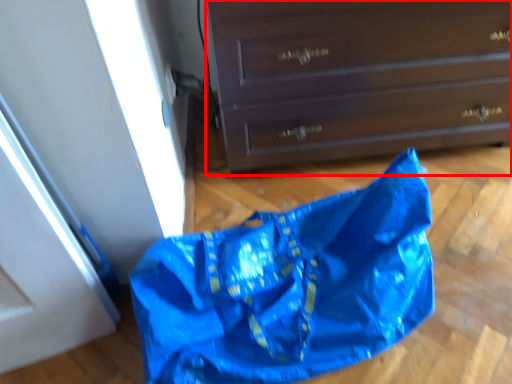
Question: Observing the image, what is the correct spatial positioning of chest of drawers (annotated by the red box) in reference to grocery bag?

Choices:
 (A) left
 (B) right

Answer: (B)